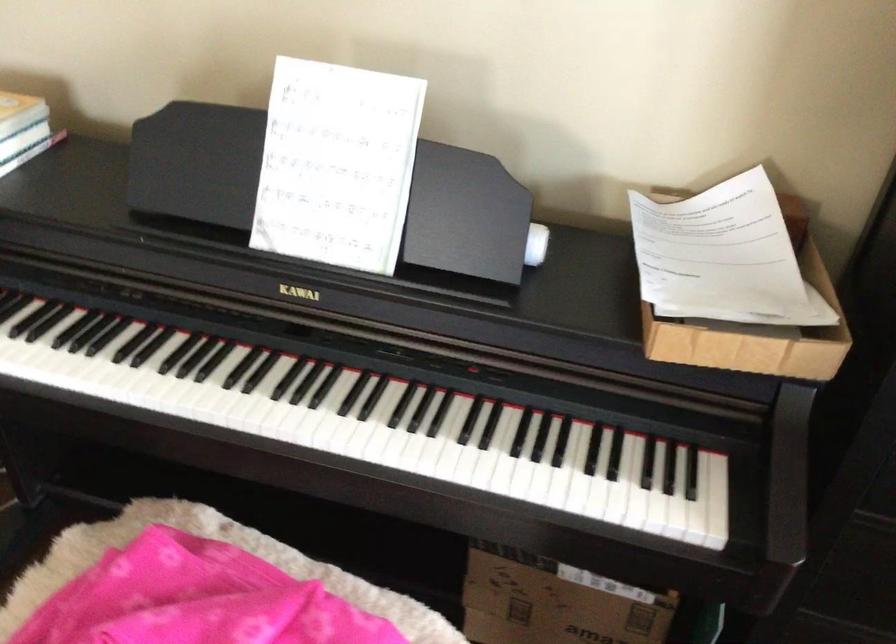
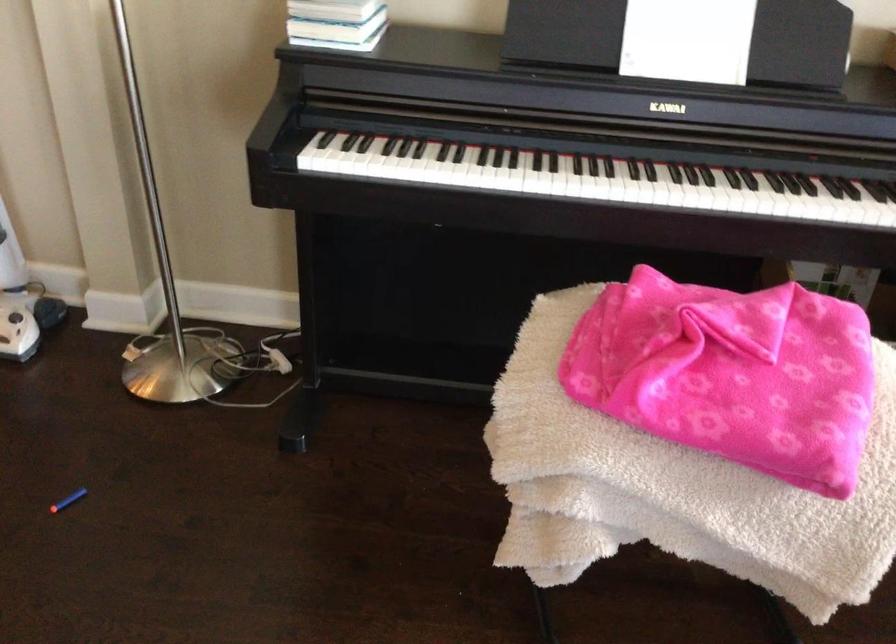
Question: What movement of the cameraman would produce the second image?

Choices:
 (A) Left
 (B) Right
 (C) Forward
 (D) Backward

Answer: (A)